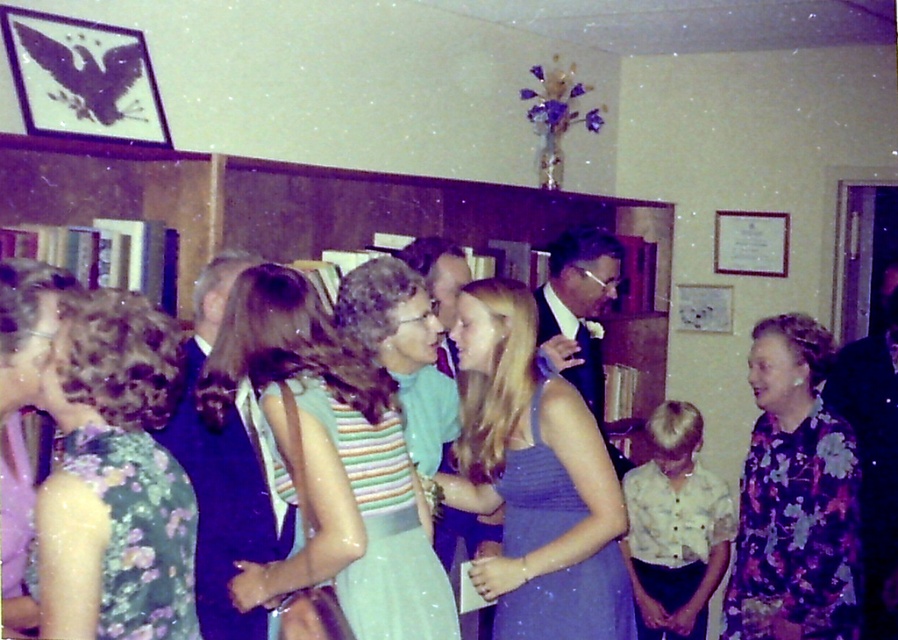
Question: Based on their relative distances, which object is farther from the matte blue dress at center?

Choices:
 (A) floral print dress at right
 (B) yellow cotton shirt at lower right
 (C) green satin dress at center

Answer: (B)

Question: Which of the following is the closest to the observer?

Choices:
 (A) click(153, 374)
 (B) click(199, 403)
 (C) click(429, 576)

Answer: (A)

Question: Is floral print dress at right further to camera compared to satin purple dress at center?

Choices:
 (A) no
 (B) yes

Answer: (B)

Question: Is matte blue dress at center above satin purple dress at center?

Choices:
 (A) no
 (B) yes

Answer: (B)

Question: Does floral print dress at right appear on the right side of green satin dress at center?

Choices:
 (A) no
 (B) yes

Answer: (B)

Question: Which point is closer to the camera taking this photo?

Choices:
 (A) (543, 500)
 (B) (646, 588)
 (C) (92, 301)
 (D) (383, 620)

Answer: (C)